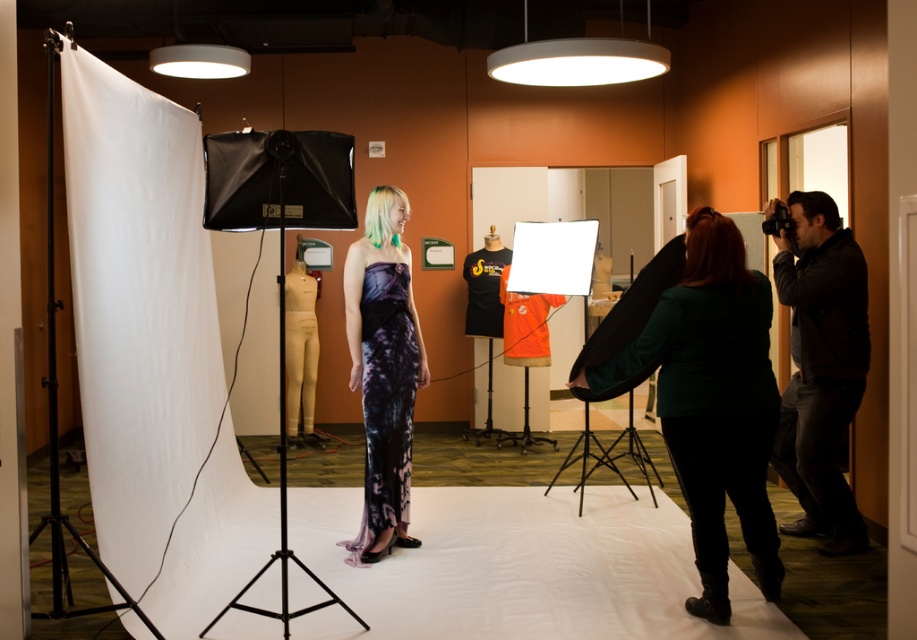
Can you confirm if green matte jacket at right is positioned above purple tie-dye fabric dress at center?

No, green matte jacket at right is not above purple tie-dye fabric dress at center.

Is green matte jacket at right thinner than purple tie-dye fabric dress at center?

No.

Locate an element on the screen. This screenshot has height=640, width=917. green matte jacket at right is located at coordinates tap(704, 394).

I want to click on green matte jacket at right, so click(704, 394).

Is the position of dark brown leather jacket at right more distant than that of purple tie-dye fabric dress at center?

No, it is in front of purple tie-dye fabric dress at center.

Is dark brown leather jacket at right thinner than purple tie-dye fabric dress at center?

Incorrect, dark brown leather jacket at right's width is not less than purple tie-dye fabric dress at center's.

The image size is (917, 640). What do you see at coordinates (820, 365) in the screenshot?
I see `dark brown leather jacket at right` at bounding box center [820, 365].

I want to click on dark brown leather jacket at right, so click(820, 365).

Based on the photo, which of these two, green matte jacket at right or dark brown leather jacket at right, stands taller?

Standing taller between the two is dark brown leather jacket at right.

Between green matte jacket at right and dark brown leather jacket at right, which one is positioned lower?

green matte jacket at right is below.

From the picture: Who is more forward, [768,592] or [772,449]?

Point [768,592] is in front.

Locate an element on the screen. green matte jacket at right is located at coordinates (704, 394).